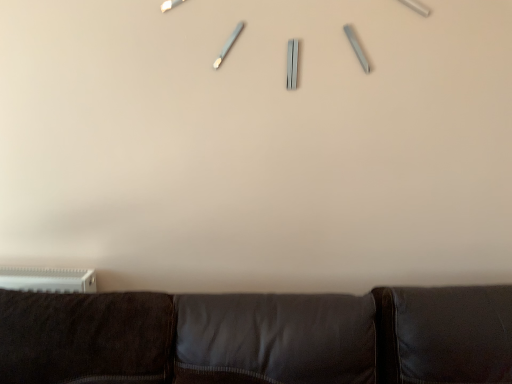
Measure the distance between point (116,294) and camera.

They are 4.37 feet apart.

The image size is (512, 384). I want to click on dark fabric couch at lower center, so click(x=258, y=337).

Describe the element at coordinates (258, 337) in the screenshot. This screenshot has width=512, height=384. I see `dark fabric couch at lower center` at that location.

Locate an element on the screen. The width and height of the screenshot is (512, 384). dark fabric couch at lower center is located at coordinates (258, 337).